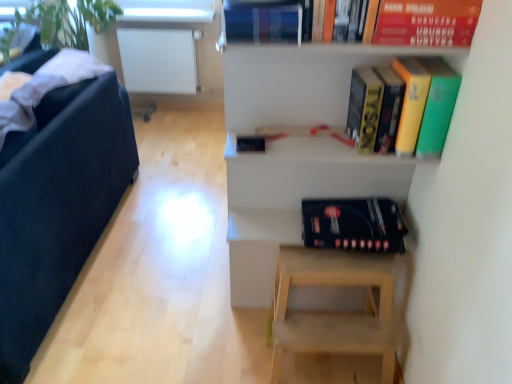
Question: Does hardcover book at upper right have a lesser width compared to black fabric armchair at left?

Choices:
 (A) yes
 (B) no

Answer: (A)

Question: Could you tell me if hardcover book at upper right is turned towards black fabric armchair at left?

Choices:
 (A) no
 (B) yes

Answer: (A)

Question: Considering the relative sizes of hardcover book at upper right and black fabric armchair at left in the image provided, is hardcover book at upper right taller than black fabric armchair at left?

Choices:
 (A) no
 (B) yes

Answer: (A)

Question: Is there a large distance between hardcover book at upper right and black fabric armchair at left?

Choices:
 (A) yes
 (B) no

Answer: (A)

Question: From the image's perspective, is hardcover book at upper right on black fabric armchair at left?

Choices:
 (A) no
 (B) yes

Answer: (B)

Question: From the image's perspective, relative to white matte radiator at upper left, is hardcover book at upper center, placed as the 2th paperback book when sorted from right to left, above or below?

Choices:
 (A) above
 (B) below

Answer: (B)

Question: Is hardcover book at upper center, the 1th paperback book viewed from the left, wider or thinner than white matte radiator at upper left?

Choices:
 (A) thin
 (B) wide

Answer: (A)

Question: From a real-world perspective, relative to white matte radiator at upper left, is hardcover book at upper center, placed as the 2th paperback book when sorted from right to left, vertically above or below?

Choices:
 (A) above
 (B) below

Answer: (A)

Question: Is hardcover book at upper center, the 1th paperback book viewed from the left, inside or outside of white matte radiator at upper left?

Choices:
 (A) inside
 (B) outside

Answer: (B)

Question: From a real-world perspective, is hardcover book at upper center, the 1th paperback book viewed from the left, positioned above or below black fabric armchair at left?

Choices:
 (A) above
 (B) below

Answer: (A)

Question: In terms of height, does hardcover book at upper center, placed as the 2th paperback book when sorted from right to left, look taller or shorter compared to black fabric armchair at left?

Choices:
 (A) tall
 (B) short

Answer: (B)

Question: Does point (269, 31) appear closer or farther from the camera than point (38, 216)?

Choices:
 (A) farther
 (B) closer

Answer: (B)

Question: From the image's perspective, is hardcover book at upper center, placed as the 2th paperback book when sorted from right to left, positioned above or below black fabric armchair at left?

Choices:
 (A) above
 (B) below

Answer: (A)

Question: Is white matte radiator at upper left in front of or behind black matte album at lower center in the image?

Choices:
 (A) front
 (B) behind

Answer: (B)

Question: In terms of size, does white matte radiator at upper left appear bigger or smaller than black matte album at lower center?

Choices:
 (A) big
 (B) small

Answer: (A)